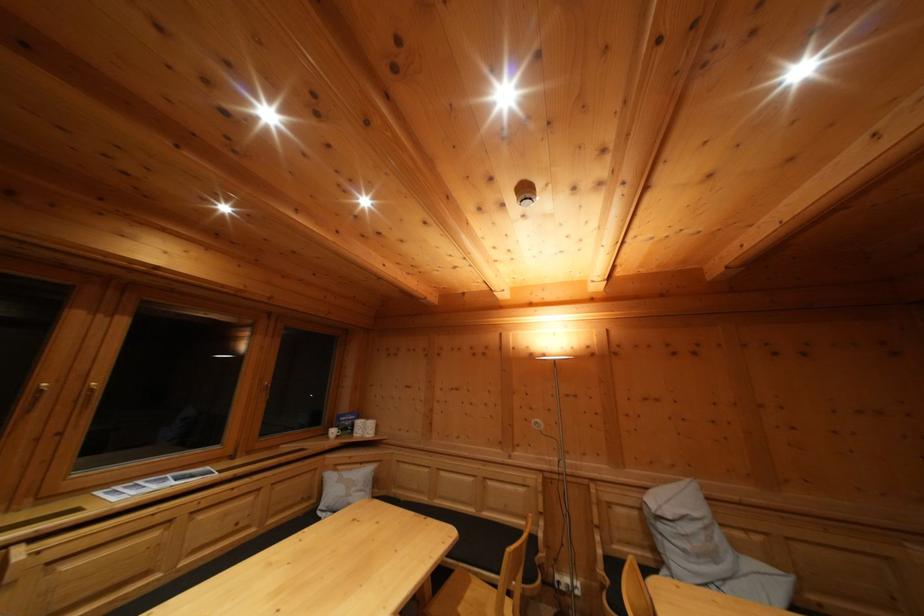
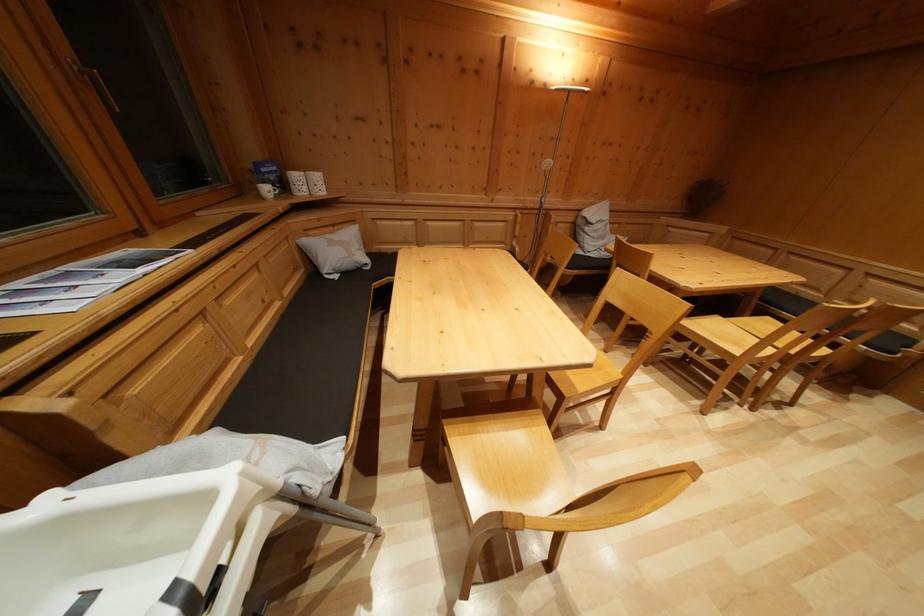
In the second image, find the point that corresponds to [368,469] in the first image.

(338, 233)